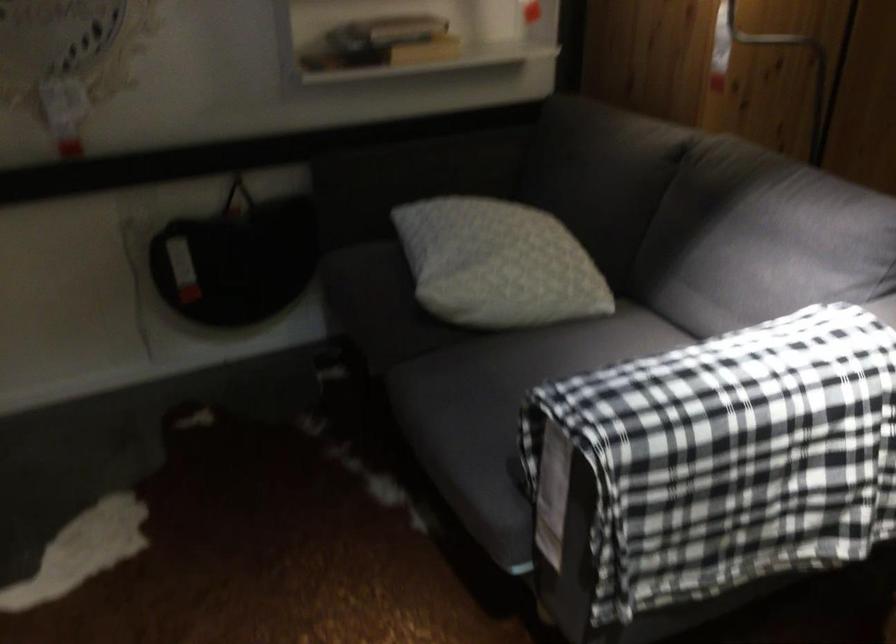
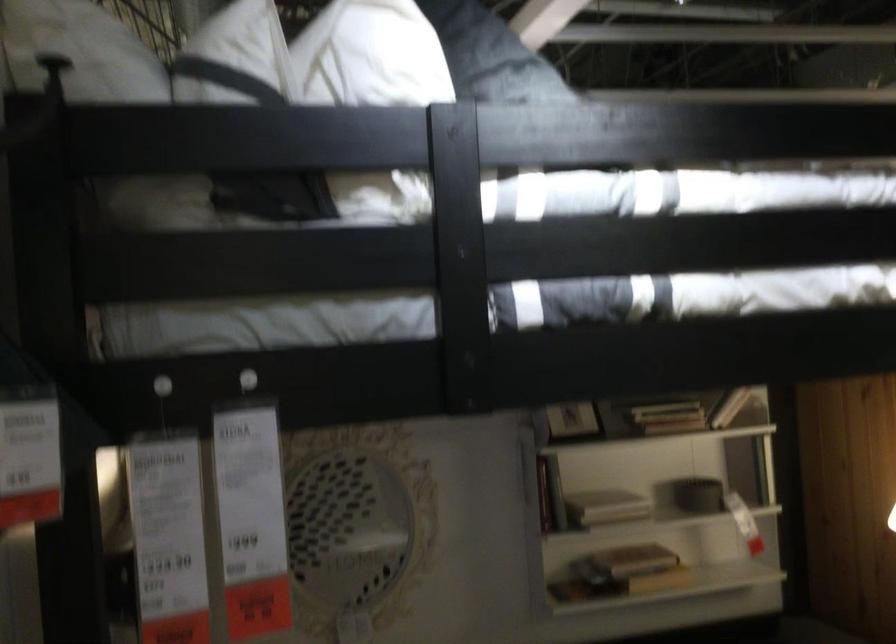
How did the camera likely rotate?

The rotation direction of the camera is left-up.